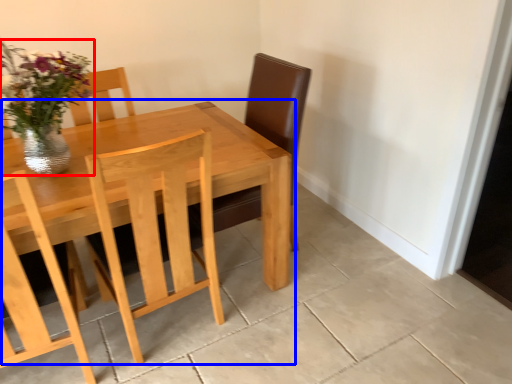
Question: Which object is closer to the camera taking this photo, floral arrangement (highlighted by a red box) or kitchen & dining room table (highlighted by a blue box)?

Choices:
 (A) floral arrangement
 (B) kitchen & dining room table

Answer: (B)